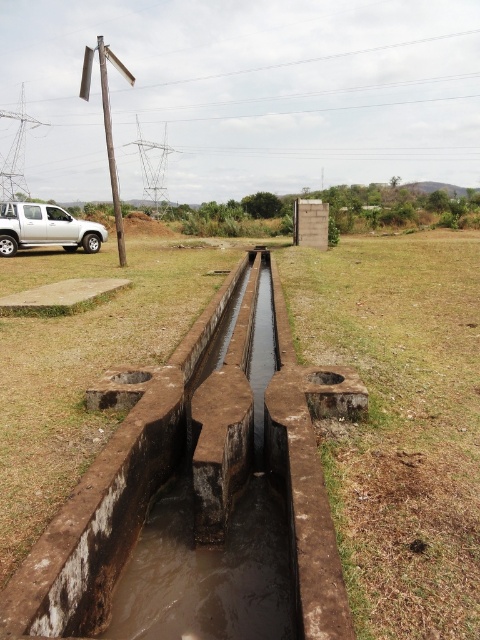
Question: Which object is closer to the camera taking this photo?

Choices:
 (A) brown dry grass at lower center
 (B) silver metallic truck at left

Answer: (A)

Question: Is brown dry grass at lower center positioned at the back of silver metallic truck at left?

Choices:
 (A) yes
 (B) no

Answer: (B)

Question: Can you confirm if brown dry grass at lower center is positioned to the right of silver metallic truck at left?

Choices:
 (A) no
 (B) yes

Answer: (B)

Question: Can you confirm if brown dry grass at lower center is positioned above silver metallic truck at left?

Choices:
 (A) yes
 (B) no

Answer: (B)

Question: Which point is farther to the camera?

Choices:
 (A) (67, 237)
 (B) (465, 467)

Answer: (A)